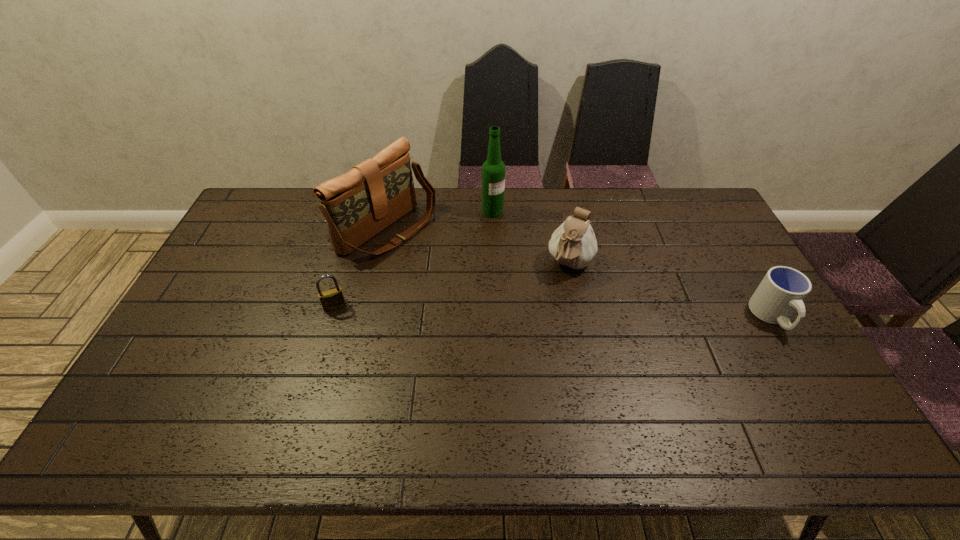
You are a GUI agent. You are given a task and a screenshot of the screen. Output one action in this format:
    pyautogui.click(x=<x>, y=<y>)
    Task: Click on the object situated at the right edge
    
    Given the screenshot: What is the action you would take?
    pyautogui.click(x=782, y=291)

Find the location of a particular element. This screenshot has height=540, width=960. free space at the far edge of the desktop is located at coordinates (656, 221).

Locate an element on the screen. Image resolution: width=960 pixels, height=540 pixels. vacant region at the near edge of the desktop is located at coordinates (674, 401).

Find the location of a particular element. free space at the left edge is located at coordinates (231, 251).

Find the location of a particular element. This screenshot has height=540, width=960. vacant space at the far left corner of the desktop is located at coordinates (269, 206).

I want to click on free point between the padlock and the third object from right to left, so click(414, 259).

Locate an element on the screen. Image resolution: width=960 pixels, height=540 pixels. free space between the cup and the pouch is located at coordinates (671, 291).

Locate an element on the screen. vacant point located between the cup and the padlock is located at coordinates point(553,312).

Identify the location of vacant point located between the padlock and the shoulder bag. (361, 269).

Where is `vacant space that's between the padlock and the cup`? This screenshot has width=960, height=540. vacant space that's between the padlock and the cup is located at coordinates (553, 312).